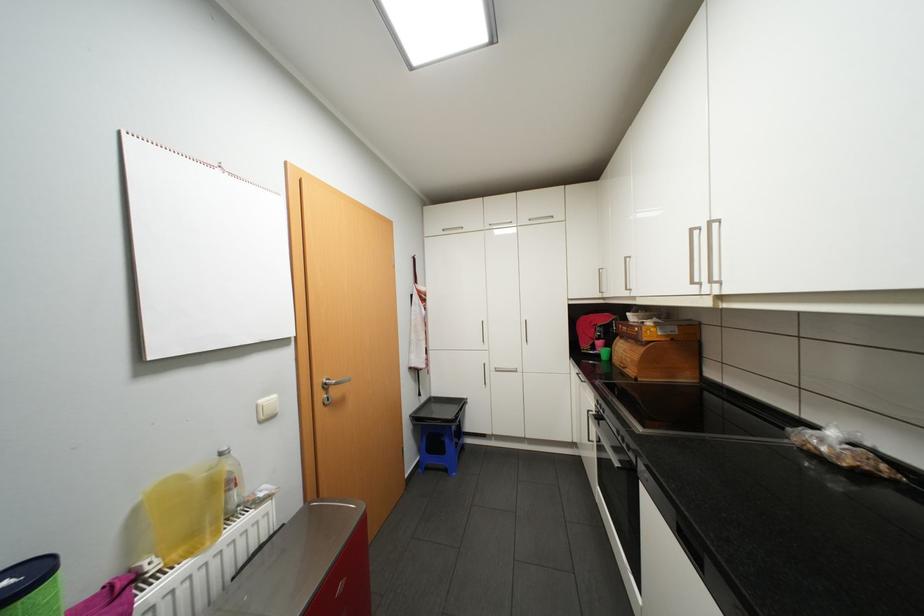
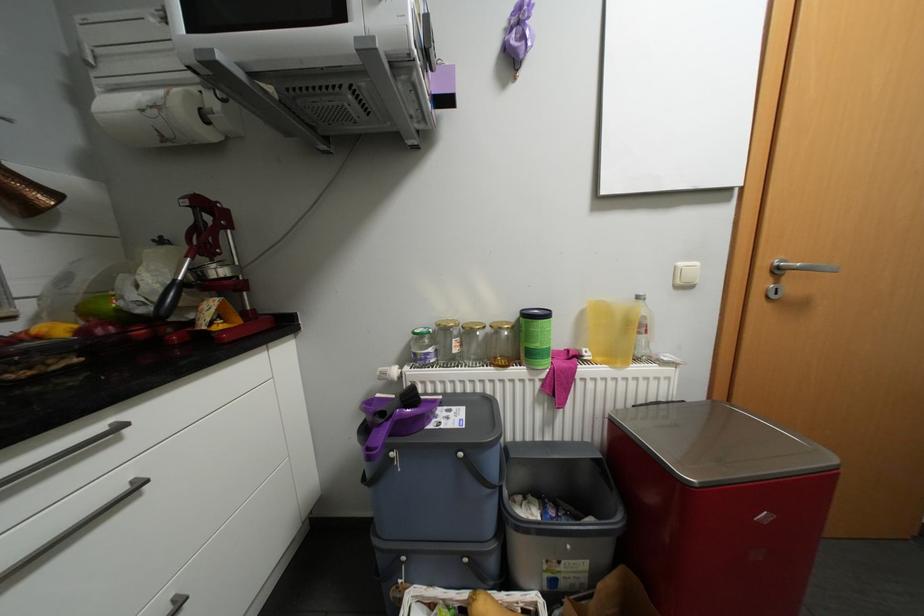
Question: Based on the continuous images, in which direction is the camera rotating? Reply with the corresponding letter.

Choices:
 (A) Left
 (B) Right
 (C) Up
 (D) Down

Answer: (A)